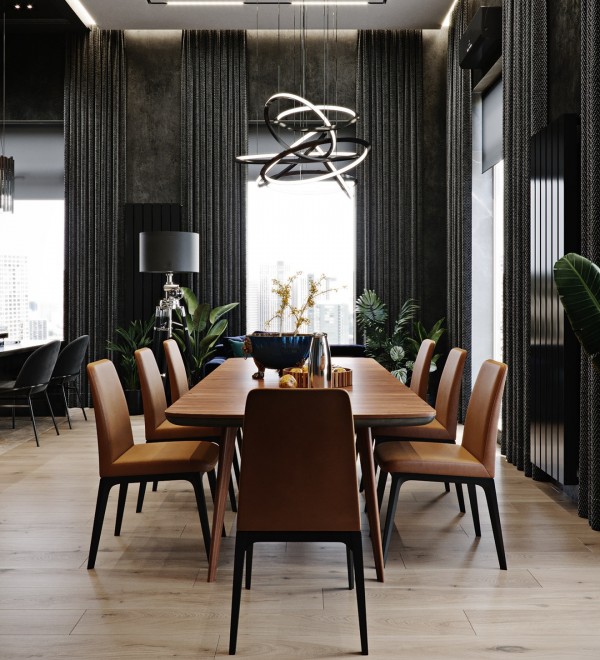
Where is `chairs`? The width and height of the screenshot is (600, 660). chairs is located at coordinates (173, 360), (147, 380), (117, 400), (317, 439), (491, 393), (454, 375), (423, 365).